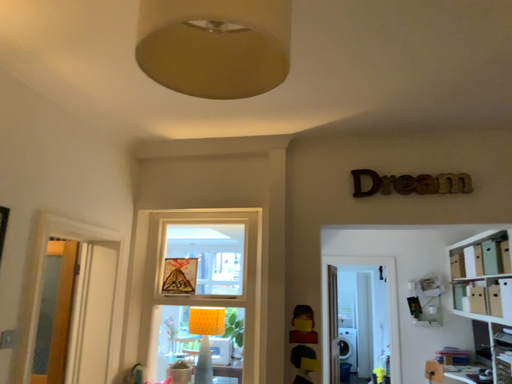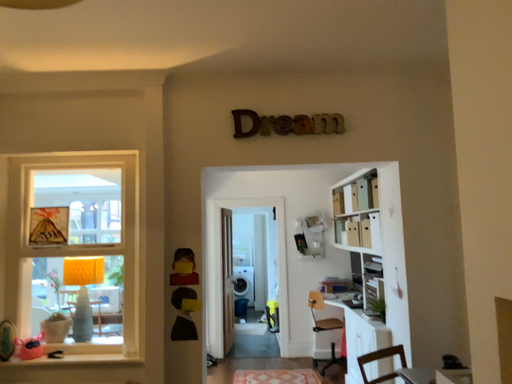
Question: How did the camera likely rotate when shooting the video?

Choices:
 (A) rotated downward
 (B) rotated upward

Answer: (A)